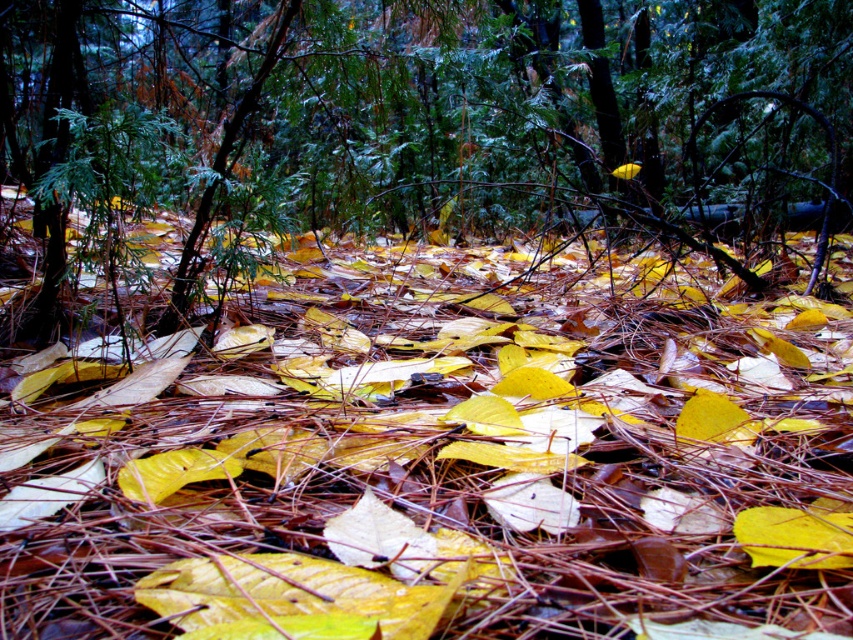
In the scene shown: You are a hiker who wants to place a small flag exactly between the yellow matte leaves at center and the green textured pine tree at center. Which object will the flag be closer to?

The flag will be closer to the yellow matte leaves at center because it is shorter than the green textured pine tree at center.

In the scene shown: You are standing in the forest and want to reach the two points marked in the scene. Which point, point [680,426] or point [73,44], is closer to you?

Point [680,426] is closer to you than point [73,44].

You are a hiker who wants to place a small backpack between the yellow matte leaves at center and the green textured pine tree at center. Which object should you place the backpack closer to so that it doesn t get buried by the leaves?

The yellow matte leaves at center are wider than the green textured pine tree at center. To prevent the backpack from being buried, place it closer to the green textured pine tree at center since its narrower width will leave more space.